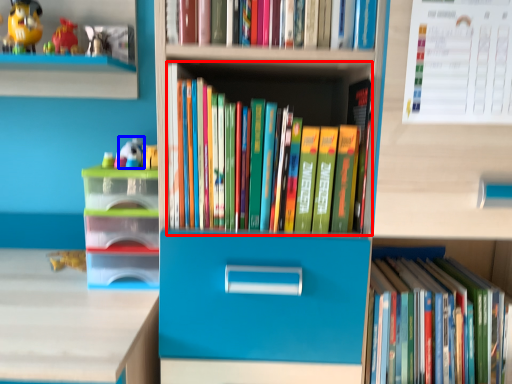
Question: Which object is further to the camera taking this photo, book (highlighted by a red box) or toy (highlighted by a blue box)?

Choices:
 (A) book
 (B) toy

Answer: (B)